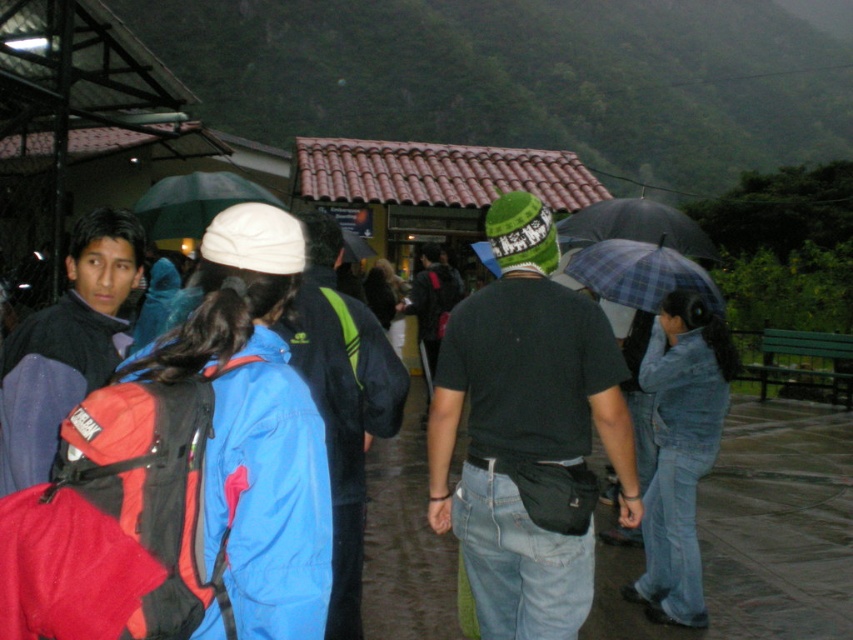
You are standing at point (627,234) and want to walk to point (206,182). Based on the scene description, will you be moving towards the building with the red roof or away from it?

Point (206,182) is behind point (627,234). Since you are moving from point (627,234) to point (206,182), you will be moving towards the building with the red roof as the destination point is behind the starting point relative to the building.

You are standing in the rain at the scene described. You see two umbrellas at the center. Which one is closer to you, the plaid fabric umbrella at center or the transparent plastic umbrella at center?

The plaid fabric umbrella at center is closer to you because it is in front of the transparent plastic umbrella at center.

You are standing at the edge of the scene and want to walk from the green matte umbrella at upper center to the plaid fabric umbrella at center. Given that the path between them is 2.79 meters, can you estimate whether a 3.0 meter long walking stick would reach from one to the other without touching the ground?

The distance between the green matte umbrella at upper center and the plaid fabric umbrella at center is 2.79 meters. Since the walking stick is 3.0 meters long, it would be long enough to span the distance between them without touching the ground.